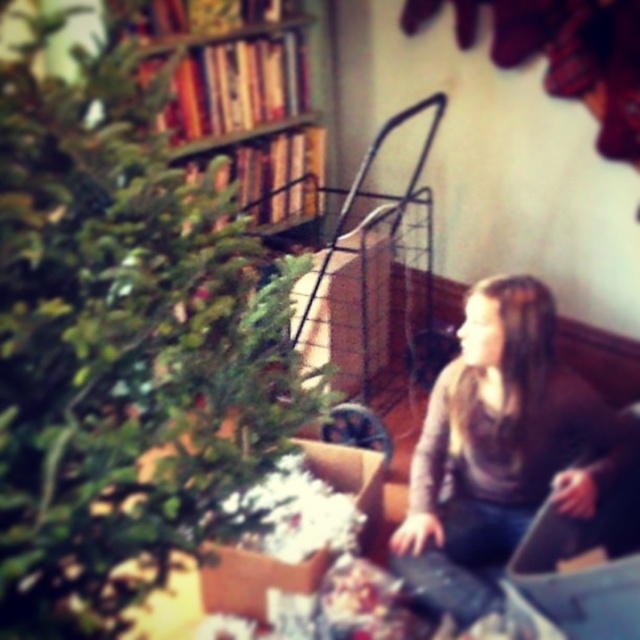
Question: Which object appears closest to the camera in this image?

Choices:
 (A) green matte christmas tree at left
 (B) wooden bookshelf at upper center

Answer: (A)

Question: Can you confirm if green matte christmas tree at left is bigger than matte brown sweater at lower right?

Choices:
 (A) yes
 (B) no

Answer: (A)

Question: Can you confirm if matte brown sweater at lower right is thinner than wooden bookshelf at upper center?

Choices:
 (A) yes
 (B) no

Answer: (B)

Question: Is green matte christmas tree at left smaller than wooden bookshelf at upper center?

Choices:
 (A) no
 (B) yes

Answer: (B)

Question: Which point appears farthest from the camera in this image?

Choices:
 (A) (67, 609)
 (B) (544, 387)
 (C) (248, 65)

Answer: (C)

Question: Which point appears closest to the camera in this image?

Choices:
 (A) (262, 289)
 (B) (209, 77)

Answer: (A)